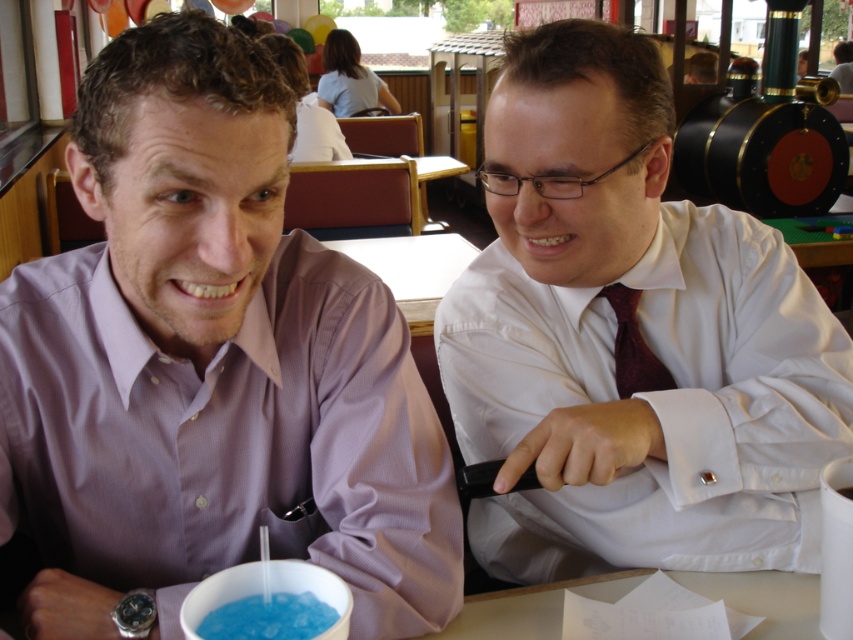
In the scene shown: You are a photographer taking a photo of the white glossy shirt at upper right and the maroon textured tie at right. Which object should you focus on first if you want to ensure both are in focus?

The white glossy shirt at upper right is much taller than the maroon textured tie at right, so focusing on the white glossy shirt at upper right first would help ensure both are in focus as it is the larger subject.

Based on the photo, you are a server at a diner and need to check if the blue translucent liquid at lower center in the customer drink can be refilled without spilling. The glass can hold up to 200ml. The liquid currently is at a height that is not as tall as the maroon textured tie at right. Can you safely refill it?

The blue translucent liquid at lower center is not as tall as the maroon textured tie at right. Since the tie is taller than the current liquid level, there is space to refill the drink without spilling, so yes, it can be safely refilled.

You are a waiter in a restaurant and need to place a 10 inch dessert plate between the matte purple shirt at left and the blue translucent liquid at lower center. Can you fit it there?

The distance between the matte purple shirt at left and the blue translucent liquid at lower center is 12.00 inches. Since the dessert plate is 10 inches wide, it can fit in the space between them.